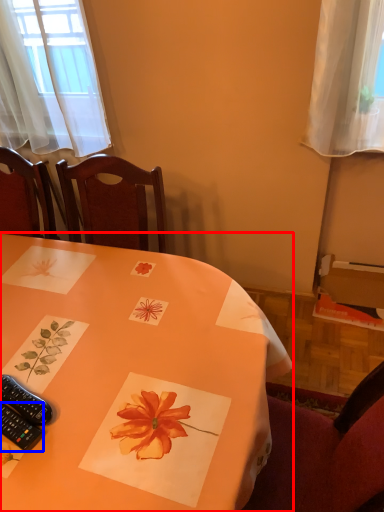
Question: Which object is further to the camera taking this photo, table (highlighted by a red box) or remote control (highlighted by a blue box)?

Choices:
 (A) table
 (B) remote control

Answer: (B)